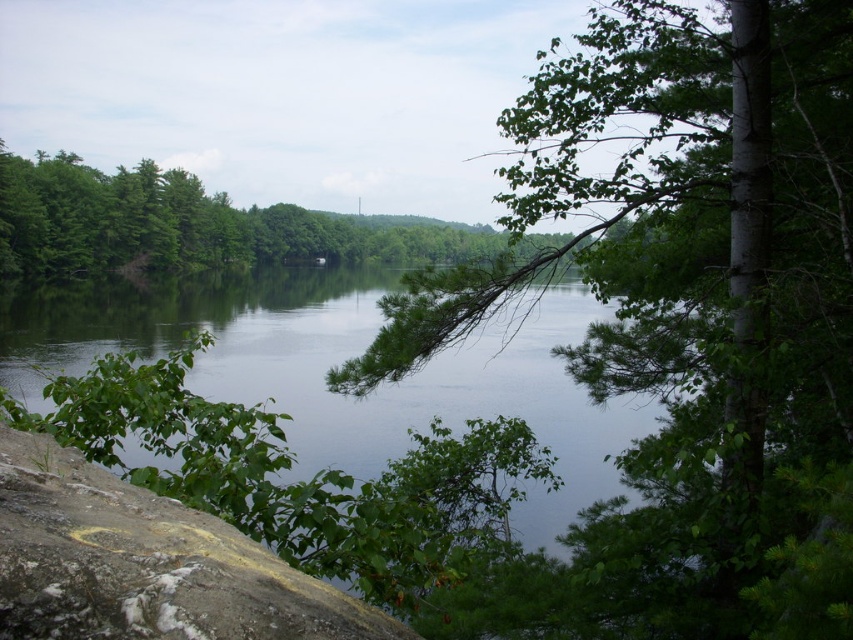
You are standing at the center of the image and want to locate the green leafy branch at center right. Which direction should you look to find it?

You should look to the right side of the image to find the green leafy branch at center right because it is positioned at point [680,324], which is towards the right half of the image.

You are standing at the edge of the water in the scene and notice a point marked at coordinates (337, 362). Based on the description, what does this point most likely represent?

The point at (337, 362) most likely represents the green leafy river at center as indicated by the description.